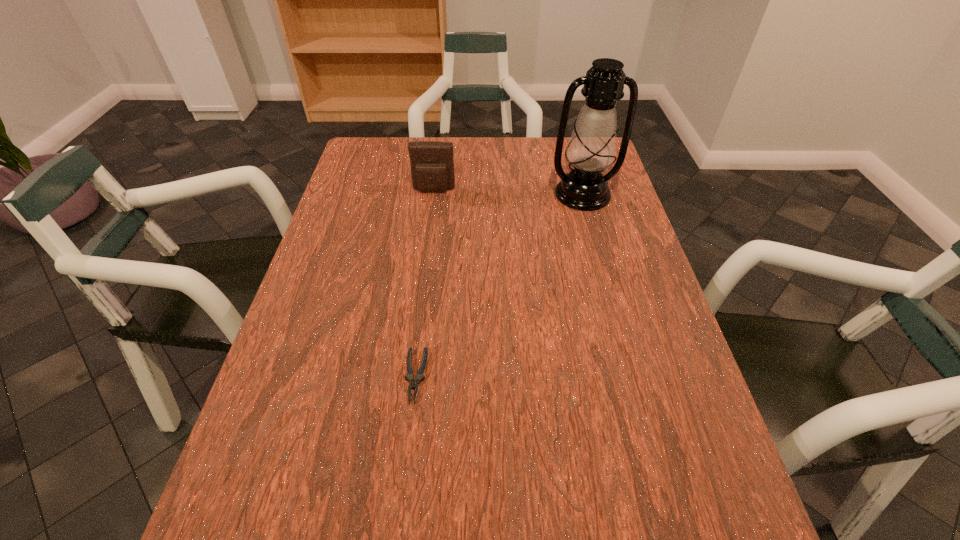
Identify the location of free space between the pouch and the rightmost object. Image resolution: width=960 pixels, height=540 pixels. pyautogui.click(x=508, y=192).

The width and height of the screenshot is (960, 540). In order to click on free area in between the pouch and the oil lamp in this screenshot , I will do `click(508, 192)`.

Locate an element on the screen. The height and width of the screenshot is (540, 960). free space between the second tallest object and the nearest object is located at coordinates (424, 284).

Identify which object is the nearest to the rightmost object. Please provide its 2D coordinates. Your answer should be formatted as a tuple, i.e. [(x, y)], where the tuple contains the x and y coordinates of a point satisfying the conditions above.

[(432, 166)]

Identify which object is the second closest to the second tallest object. Please provide its 2D coordinates. Your answer should be formatted as a tuple, i.e. [(x, y)], where the tuple contains the x and y coordinates of a point satisfying the conditions above.

[(409, 376)]

You are a GUI agent. You are given a task and a screenshot of the screen. Output one action in this format:
    pyautogui.click(x=<x>, y=<y>)
    Task: Click on the free location that satisfies the following two spatial constraints: 1. with an open flap on the oil lamp; 2. on the right side of the pouch
    This screenshot has height=540, width=960.
    Given the screenshot: What is the action you would take?
    pyautogui.click(x=434, y=194)

The width and height of the screenshot is (960, 540). In order to click on free space that satisfies the following two spatial constraints: 1. with an open flap on the oil lamp; 2. on the right side of the pouch in this screenshot , I will do `click(434, 194)`.

The image size is (960, 540). I want to click on vacant point that satisfies the following two spatial constraints: 1. with an open flap on the pouch; 2. on the left side of the rightmost object, so click(x=434, y=194).